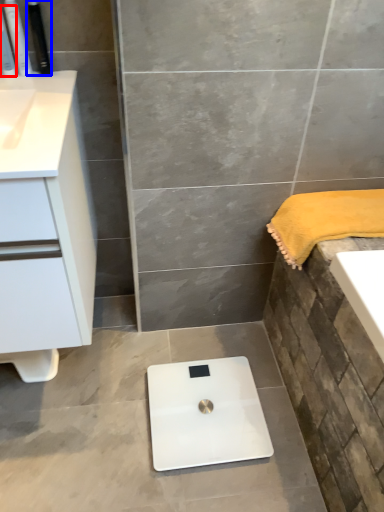
Question: Which object is closer to the camera taking this photo, toiletry (highlighted by a red box) or toiletry (highlighted by a blue box)?

Choices:
 (A) toiletry
 (B) toiletry

Answer: (A)